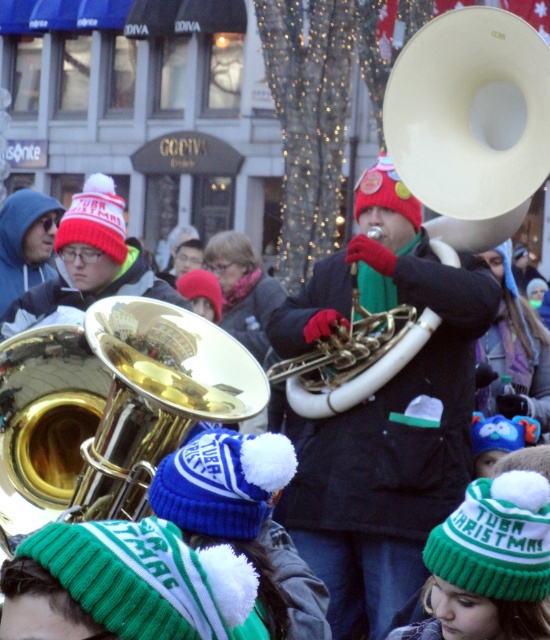
Question: Where is white matte bass horn at upper center located in relation to gold shiny trumpet at center in the image?

Choices:
 (A) left
 (B) right

Answer: (B)

Question: Among these objects, which one is nearest to the camera?

Choices:
 (A) gold brass tuba at center
 (B) gold shiny trumpet at center
 (C) white glossy trumpet at center

Answer: (B)

Question: Considering the relative positions of gold brass tuba at center and white matte bass horn at upper center in the image provided, where is gold brass tuba at center located with respect to white matte bass horn at upper center?

Choices:
 (A) left
 (B) right

Answer: (A)

Question: Estimate the real-world distances between objects in this image. Which object is closer to the gold shiny trumpet at center?

Choices:
 (A) white matte bass horn at upper center
 (B) gold brass tuba at center
 (C) white glossy trumpet at center

Answer: (C)

Question: Can you confirm if gold brass tuba at center is positioned to the right of gold shiny trumpet at center?

Choices:
 (A) no
 (B) yes

Answer: (B)

Question: Which point is closer to the camera taking this photo?

Choices:
 (A) (134, 397)
 (B) (339, 444)
 (C) (466, 148)
 (D) (333, 397)

Answer: (A)